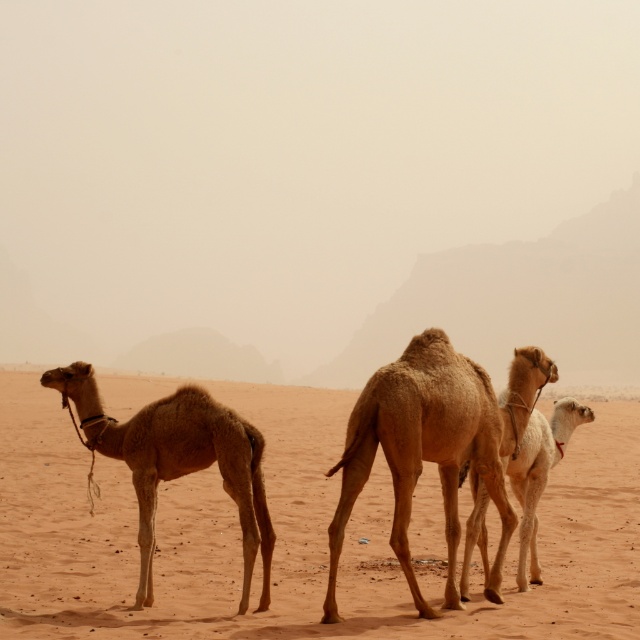
You are standing in the desert scene with three camels. You notice two points marked in the image. The first point is at coordinates point (x=477, y=636) and the second point is at point (x=369, y=420). Which of these two points is nearer to you?

Point (x=477, y=636) is closer to the viewer than point (x=369, y=420), so the first point is nearer to you.

From the picture: You are a photographer standing in the desert and want to capture a closeup shot of the brown textured camel at center. Given that you need to be at least 8 meters away to avoid disturbing it, is your current position suitable?

The brown textured camel at center is 7.83 meters from camera, which is less than the required 8 meters. Therefore, your current position is too close to avoid disturbing it. You need to move back further to maintain a safe distance.

You are a photographer trying to capture the camels in the desert scene. You notice the brown textured camel at center and the light brown smooth camel at center. Which camel is positioned higher in the image?

The brown textured camel at center is positioned higher in the image than the light brown smooth camel at center.